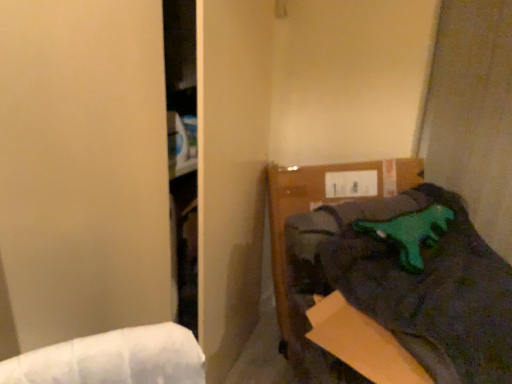
Question: Considering the positions of green rubber dinosaur at upper right and green plastic dinosaur at upper right in the image, is green rubber dinosaur at upper right bigger or smaller than green plastic dinosaur at upper right?

Choices:
 (A) small
 (B) big

Answer: (A)

Question: Choose the correct answer: Is green rubber dinosaur at upper right inside green plastic dinosaur at upper right or outside it?

Choices:
 (A) inside
 (B) outside

Answer: (A)

Question: From the image's perspective, is green rubber dinosaur at upper right above or below green plastic dinosaur at upper right?

Choices:
 (A) below
 (B) above

Answer: (B)

Question: In the image, is green plastic dinosaur at upper right positioned in front of or behind green rubber dinosaur at upper right?

Choices:
 (A) front
 (B) behind

Answer: (A)

Question: Is green plastic dinosaur at upper right situated inside green rubber dinosaur at upper right or outside?

Choices:
 (A) inside
 (B) outside

Answer: (B)

Question: Considering the positions of green plastic dinosaur at upper right and green rubber dinosaur at upper right in the image, is green plastic dinosaur at upper right taller or shorter than green rubber dinosaur at upper right?

Choices:
 (A) tall
 (B) short

Answer: (A)

Question: In terms of width, does green plastic dinosaur at upper right look wider or thinner when compared to green rubber dinosaur at upper right?

Choices:
 (A) wide
 (B) thin

Answer: (A)